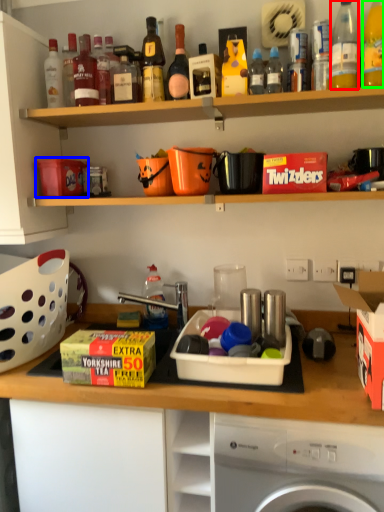
Question: Which is nearer to the bottle (highlighted by a red box)? box (highlighted by a blue box) or bottle (highlighted by a green box).

Choices:
 (A) box
 (B) bottle

Answer: (B)